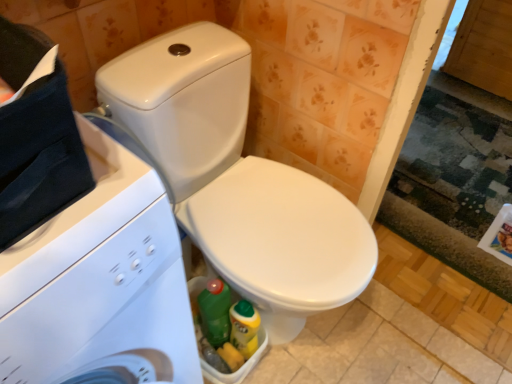
Question: Should I look upward or downward to see white glossy washing machine at left?

Choices:
 (A) down
 (B) up

Answer: (A)

Question: Is white glossy washing machine at left shorter than white glossy toilet at center?

Choices:
 (A) no
 (B) yes

Answer: (A)

Question: Is white glossy washing machine at left smaller than white glossy toilet at center?

Choices:
 (A) yes
 (B) no

Answer: (A)

Question: Would you say white glossy washing machine at left is outside white glossy toilet at center?

Choices:
 (A) yes
 (B) no

Answer: (A)

Question: Does white glossy washing machine at left appear on the right side of white glossy toilet at center?

Choices:
 (A) no
 (B) yes

Answer: (A)

Question: Does white glossy washing machine at left come behind white glossy toilet at center?

Choices:
 (A) no
 (B) yes

Answer: (A)

Question: Is white glossy washing machine at left far away from white glossy toilet at center?

Choices:
 (A) no
 (B) yes

Answer: (A)

Question: Does white glossy toilet at center come in front of white glossy washing machine at left?

Choices:
 (A) no
 (B) yes

Answer: (A)

Question: From the image's perspective, is white glossy toilet at center above white glossy washing machine at left?

Choices:
 (A) yes
 (B) no

Answer: (A)

Question: Considering the relative sizes of white glossy toilet at center and white glossy washing machine at left in the image provided, is white glossy toilet at center bigger than white glossy washing machine at left?

Choices:
 (A) yes
 (B) no

Answer: (A)

Question: Is white glossy toilet at center positioned beyond the bounds of white glossy washing machine at left?

Choices:
 (A) no
 (B) yes

Answer: (B)

Question: Can you confirm if white glossy toilet at center is shorter than white glossy washing machine at left?

Choices:
 (A) yes
 (B) no

Answer: (A)

Question: Considering the relative sizes of white glossy toilet at center and white glossy washing machine at left in the image provided, is white glossy toilet at center taller than white glossy washing machine at left?

Choices:
 (A) yes
 (B) no

Answer: (B)

Question: From the image's perspective, is white glossy washing machine at left located above or below white glossy toilet at center?

Choices:
 (A) below
 (B) above

Answer: (A)